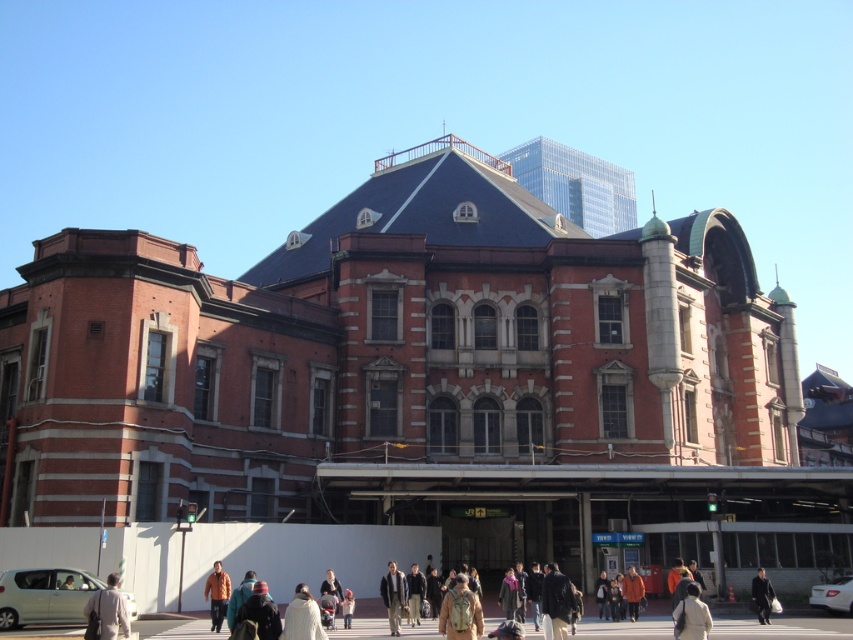
Question: Which of the following is the closest to the observer?

Choices:
 (A) (547, 570)
 (B) (418, 602)

Answer: (B)

Question: Does tan fabric backpack at center have a lesser width compared to dark brown leather jacket at lower right?

Choices:
 (A) no
 (B) yes

Answer: (B)

Question: Does dark brown leather jacket at center have a greater width compared to orange jacket at lower center?

Choices:
 (A) no
 (B) yes

Answer: (B)

Question: Does dark brown leather jacket at lower right come in front of orange jacket at lower center?

Choices:
 (A) no
 (B) yes

Answer: (B)

Question: Which object is positioned farthest from the dark gray jacket at center?

Choices:
 (A) white wool coat at center
 (B) dark brown leather jacket at center

Answer: (B)

Question: Estimate the real-world distances between objects in this image. Which object is farther from the dark gray jacket at center?

Choices:
 (A) orange jacket at lower center
 (B) white wool coat at center
 (C) velvet black jacket at lower center

Answer: (C)